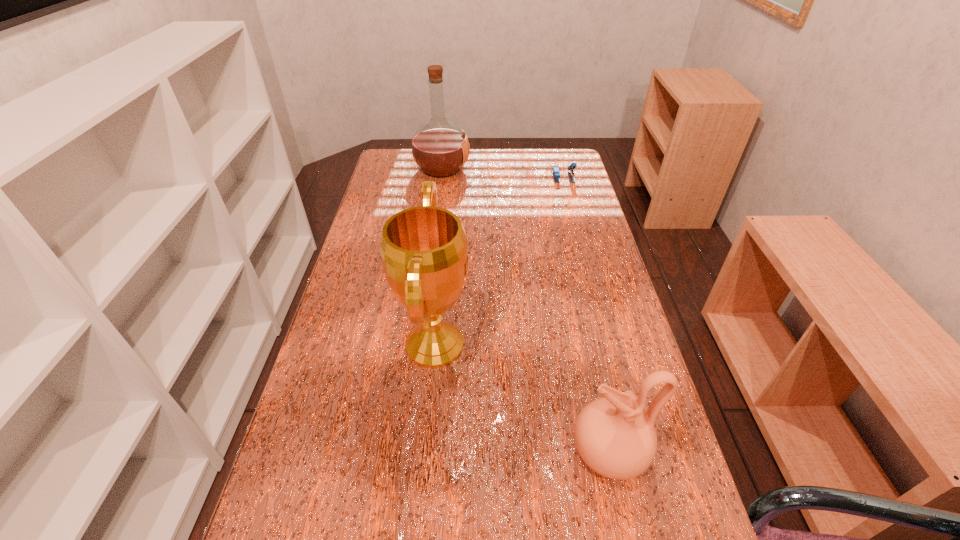
You are a GUI agent. You are given a task and a screenshot of the screen. Output one action in this format:
    pyautogui.click(x=<x>, y=<y>)
    Task: Click on the vacant region located 0.340m on the left of the shortest object
    
    Given the screenshot: What is the action you would take?
    pyautogui.click(x=462, y=177)

Image resolution: width=960 pixels, height=540 pixels. Find the location of `liquor present at the far edge`. liquor present at the far edge is located at coordinates (440, 148).

Identify the location of stapler located in the far edge section of the desktop. (556, 174).

Locate an element on the screen. Image resolution: width=960 pixels, height=540 pixels. object present at the left edge is located at coordinates (440, 148).

The width and height of the screenshot is (960, 540). What are the coordinates of `pottery at the right edge` in the screenshot? It's located at (615, 438).

You are a GUI agent. You are given a task and a screenshot of the screen. Output one action in this format:
    pyautogui.click(x=<x>, y=<y>)
    Task: Click on the stapler that is at the right edge
    The image size is (960, 540).
    Given the screenshot: What is the action you would take?
    pyautogui.click(x=556, y=174)

The image size is (960, 540). What are the coordinates of `object at the far left corner` in the screenshot? It's located at (440, 148).

Where is `object located in the far right corner section of the desktop`? The image size is (960, 540). object located in the far right corner section of the desktop is located at coordinates (556, 174).

In order to click on blank space at the far edge of the desktop in this screenshot , I will do `click(523, 157)`.

You are a GUI agent. You are given a task and a screenshot of the screen. Output one action in this format:
    pyautogui.click(x=<x>, y=<y>)
    Task: Click on the vacant space at the left edge of the desktop
    
    Given the screenshot: What is the action you would take?
    pyautogui.click(x=406, y=180)